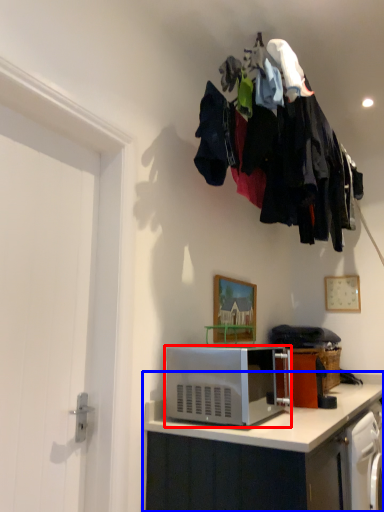
Question: Which object is closer to the camera taking this photo, microwave oven (highlighted by a red box) or cabinetry (highlighted by a blue box)?

Choices:
 (A) microwave oven
 (B) cabinetry

Answer: (B)